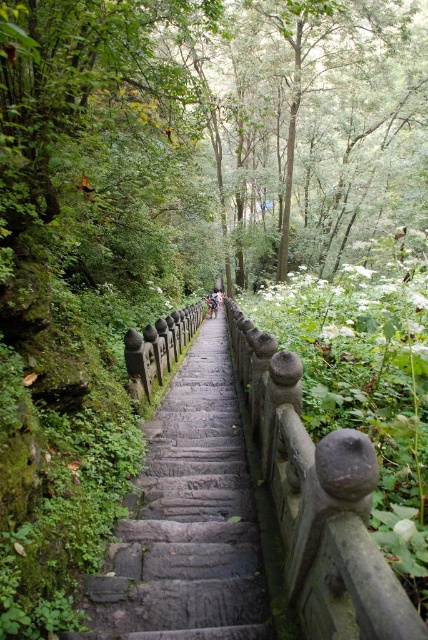
Who is higher up, gray stone stairs at center or light brown wooden stick at center?

light brown wooden stick at center is higher up.

Is point (133, 580) positioned in front of point (214, 296)?

Yes.

Is point (253, 580) farther from viewer compared to point (208, 307)?

No.

Where is `gray stone stairs at center`? gray stone stairs at center is located at coordinates (187, 518).